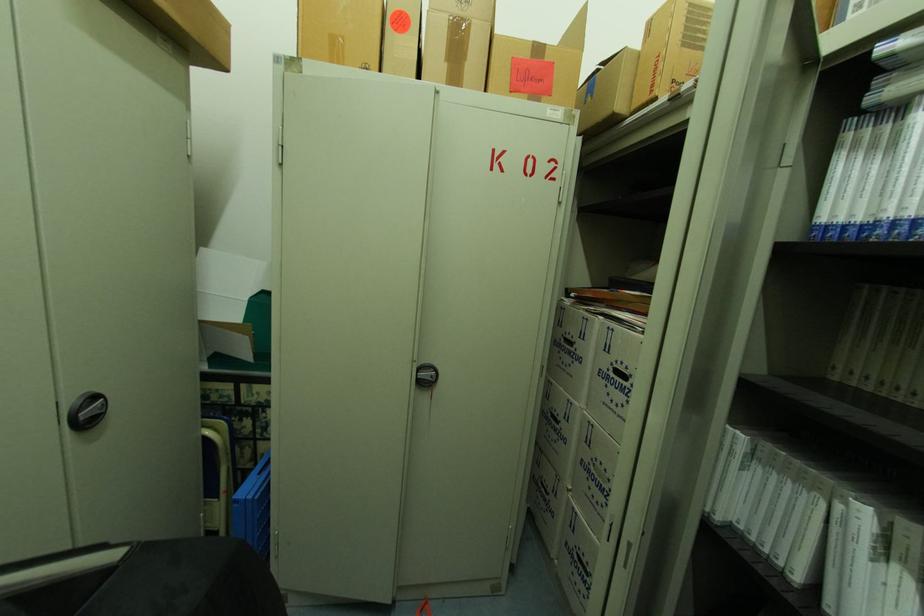
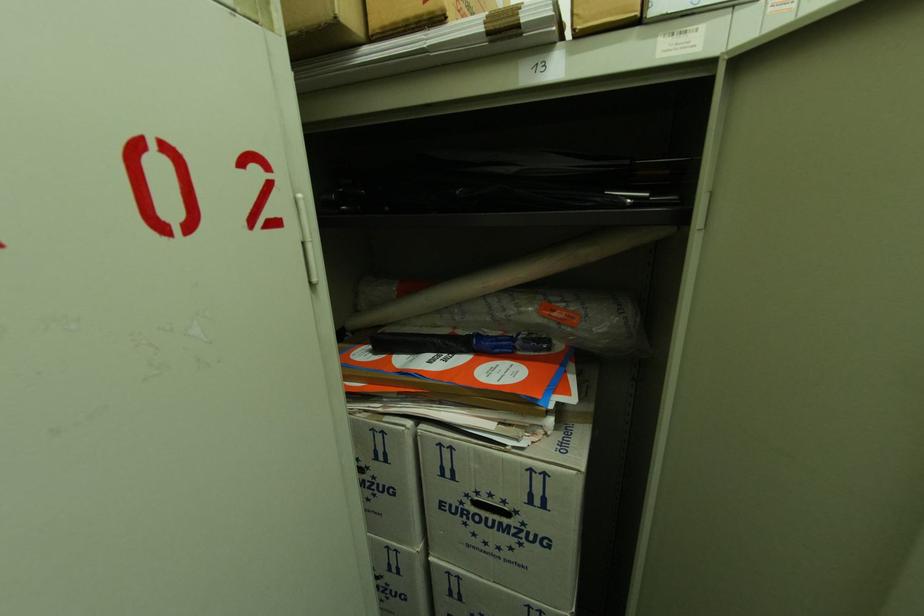
Consider the image. The images are taken continuously from a first-person perspective. In which direction is your viewpoint rotating?

The camera's rotation is toward right-down.